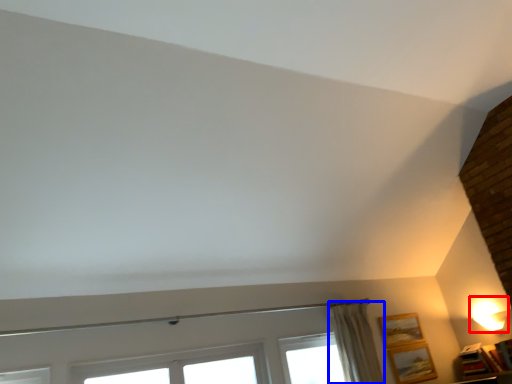
Question: Which of the following is the closest to the observer, table lamp (highlighted by a red box) or curtain (highlighted by a blue box)?

Choices:
 (A) table lamp
 (B) curtain

Answer: (B)